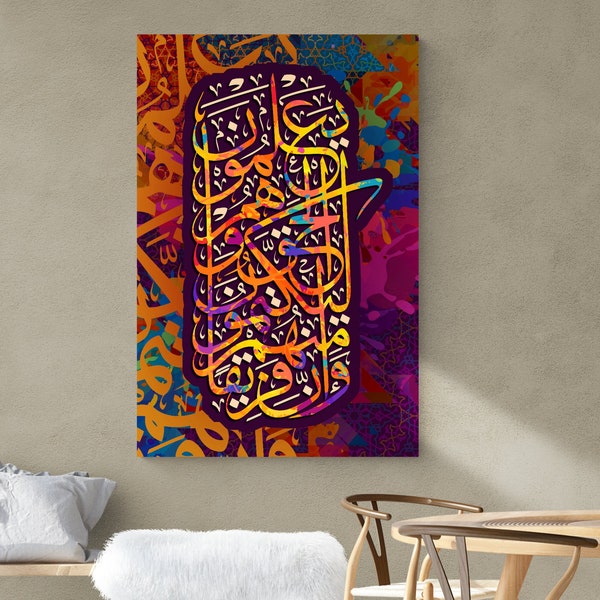
Where is `light area`? Image resolution: width=600 pixels, height=600 pixels. light area is located at coordinates (459, 413), (494, 437), (546, 474).